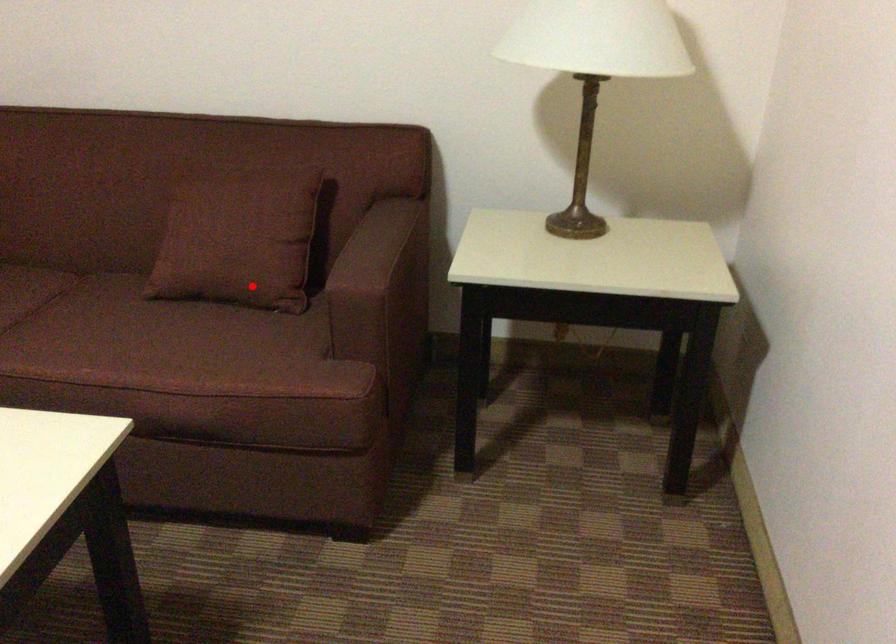
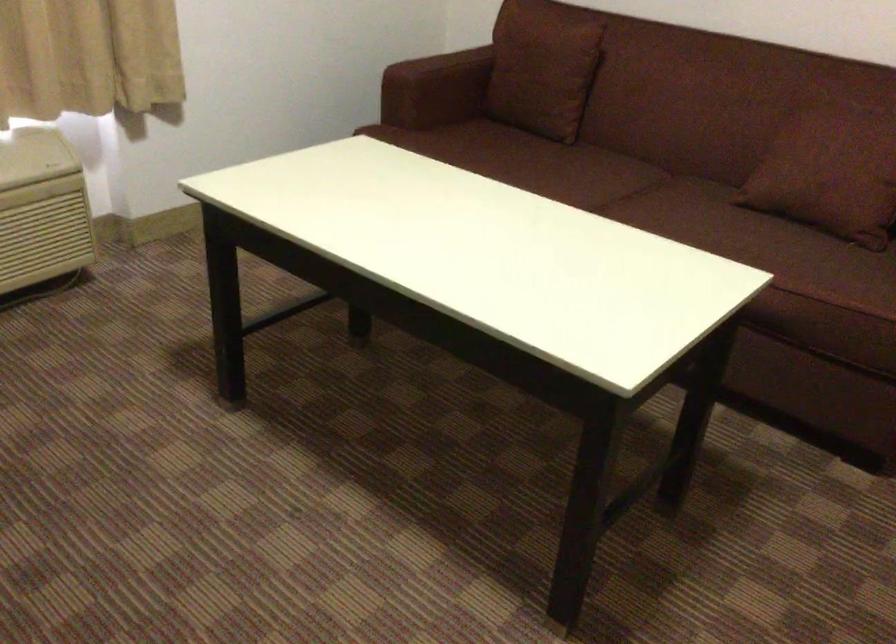
Where in the second image is the point corresponding to the highlighted location from the first image?

(842, 207)